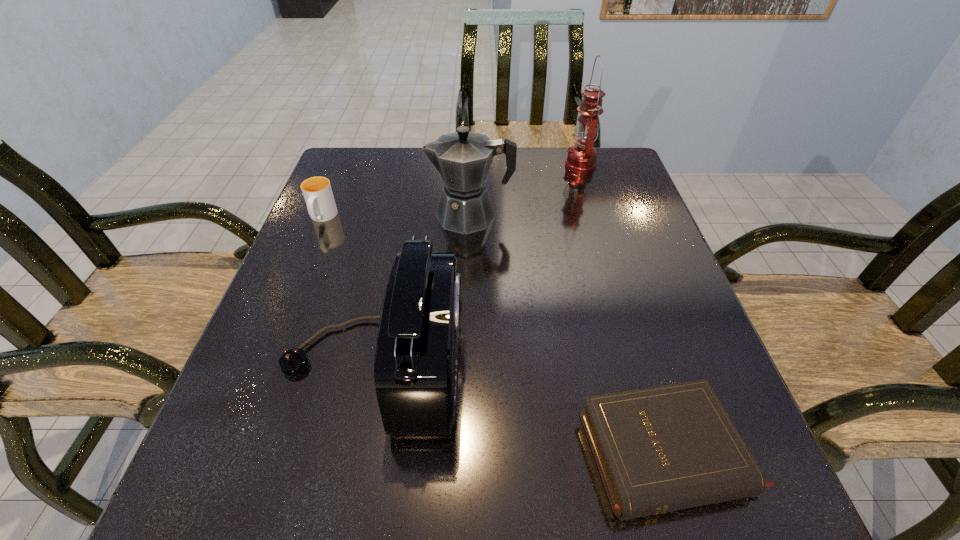
I want to click on empty location between the fourth tallest object and the coffeepot, so click(x=396, y=217).

The image size is (960, 540). Identify the location of free point between the Bible and the radio receiver. (520, 408).

The image size is (960, 540). Identify the location of free space between the farthest object and the radio receiver. (477, 262).

Image resolution: width=960 pixels, height=540 pixels. I want to click on vacant area between the radio receiver and the shortest object, so click(520, 408).

Find the location of a particular element. vacant space that's between the coffeepot and the cup is located at coordinates (396, 217).

Identify the location of empty space that is in between the farthest object and the coffeepot. (525, 190).

Identify the location of free space between the shortest object and the coffeepot. The width and height of the screenshot is (960, 540). (569, 335).

This screenshot has height=540, width=960. I want to click on object that is the second closest to the cup, so click(x=463, y=158).

Select which object is the third closest to the radio receiver. Please provide its 2D coordinates. Your answer should be formatted as a tuple, i.e. [(x, y)], where the tuple contains the x and y coordinates of a point satisfying the conditions above.

[(317, 192)]

Image resolution: width=960 pixels, height=540 pixels. Identify the location of vacant region that satisfies the following two spatial constraints: 1. at the spout of the coffeepot; 2. with the handle on the side of the cup. (470, 218).